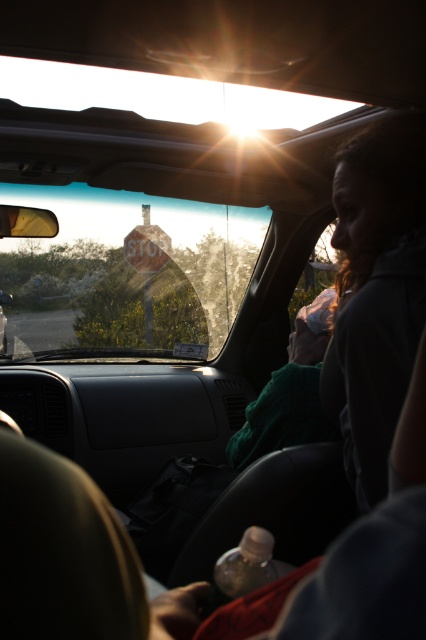
Question: Which point is closer to the camera taking this photo?

Choices:
 (A) (157, 240)
 (B) (69, 259)

Answer: (A)

Question: Is transparent glass stop sign at center to the left of rusty metal stop sign at center from the viewer's perspective?

Choices:
 (A) yes
 (B) no

Answer: (A)

Question: Which of the following is the farthest from the observer?

Choices:
 (A) transparent glass stop sign at center
 (B) rusty metal stop sign at center

Answer: (A)

Question: Observing the image, what is the correct spatial positioning of transparent glass stop sign at center in reference to rusty metal stop sign at center?

Choices:
 (A) above
 (B) below

Answer: (B)

Question: Is transparent glass stop sign at center thinner than rusty metal stop sign at center?

Choices:
 (A) no
 (B) yes

Answer: (B)